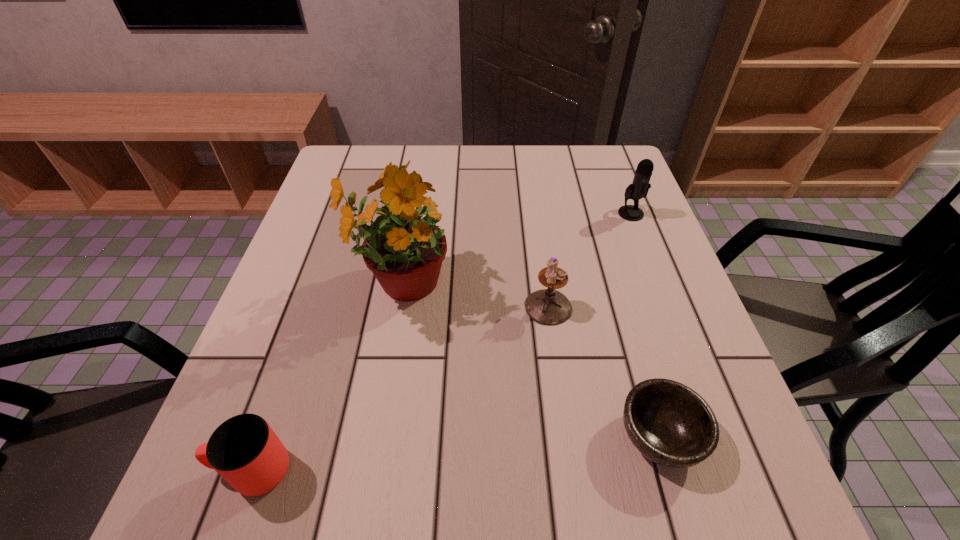
Identify the location of the tallest object. (404, 247).

I want to click on flowerpot, so click(x=404, y=247).

You are a GUI agent. You are given a task and a screenshot of the screen. Output one action in this format:
    pyautogui.click(x=<x>, y=<y>)
    Task: Click on the farthest object
    
    Given the screenshot: What is the action you would take?
    pyautogui.click(x=639, y=188)

Locate an element on the screen. The height and width of the screenshot is (540, 960). candle holder is located at coordinates (548, 306).

I want to click on the leftmost object, so click(244, 450).

Where is `cup`? cup is located at coordinates (244, 450).

Identify the location of the shortest object. This screenshot has width=960, height=540. (669, 423).

Image resolution: width=960 pixels, height=540 pixels. In order to click on vacant space located on the back of the tallest object in this screenshot , I will do `click(420, 171)`.

You are a GUI agent. You are given a task and a screenshot of the screen. Output one action in this format:
    pyautogui.click(x=<x>, y=<y>)
    Task: Click on the free region located on the front of the farthest object
    The height and width of the screenshot is (540, 960).
    Given the screenshot: What is the action you would take?
    pyautogui.click(x=649, y=260)

You are a GUI agent. You are given a task and a screenshot of the screen. Output one action in this format:
    pyautogui.click(x=<x>, y=<y>)
    Task: Click on the vacant space located 0.140m on the right of the third object from right to left
    
    Given the screenshot: What is the action you would take?
    coord(639,307)